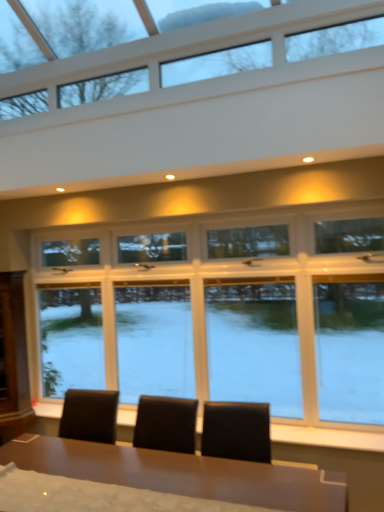
Question: From the image's perspective, is shiny brown table at center beneath clear glass window at upper center, the second window in the bottom-to-top sequence?

Choices:
 (A) yes
 (B) no

Answer: (A)

Question: Is clear glass window at upper center, positioned as the first window in top-to-bottom order, a part of shiny brown table at center?

Choices:
 (A) yes
 (B) no

Answer: (B)

Question: From a real-world perspective, is shiny brown table at center over clear glass window at upper center, positioned as the first window in top-to-bottom order?

Choices:
 (A) yes
 (B) no

Answer: (B)

Question: Is shiny brown table at center positioned far away from clear glass window at upper center, the second window in the bottom-to-top sequence?

Choices:
 (A) yes
 (B) no

Answer: (A)

Question: Does shiny brown table at center appear on the right side of clear glass window at upper center, positioned as the first window in top-to-bottom order?

Choices:
 (A) yes
 (B) no

Answer: (A)

Question: Relative to clear glass window at upper center, positioned as the first window in top-to-bottom order, is clear glass window at center, which is the first window from bottom to top, in front or behind?

Choices:
 (A) front
 (B) behind

Answer: (B)

Question: Choose the correct answer: Is clear glass window at center, which appears as the 2th window when viewed from the top, inside clear glass window at upper center, the second window in the bottom-to-top sequence, or outside it?

Choices:
 (A) inside
 (B) outside

Answer: (B)

Question: From the image's perspective, relative to clear glass window at upper center, positioned as the first window in top-to-bottom order, is clear glass window at center, which appears as the 2th window when viewed from the top, above or below?

Choices:
 (A) below
 (B) above

Answer: (A)

Question: From a real-world perspective, is clear glass window at center, which appears as the 2th window when viewed from the top, above or below clear glass window at upper center, the second window in the bottom-to-top sequence?

Choices:
 (A) below
 (B) above

Answer: (A)

Question: From a real-world perspective, is clear glass window at upper center, positioned as the first window in top-to-bottom order, positioned above or below shiny brown table at center?

Choices:
 (A) above
 (B) below

Answer: (A)

Question: Considering the positions of clear glass window at upper center, positioned as the first window in top-to-bottom order, and shiny brown table at center in the image, is clear glass window at upper center, positioned as the first window in top-to-bottom order, taller or shorter than shiny brown table at center?

Choices:
 (A) tall
 (B) short

Answer: (B)

Question: Considering the relative positions of clear glass window at upper center, the second window in the bottom-to-top sequence, and shiny brown table at center in the image provided, is clear glass window at upper center, the second window in the bottom-to-top sequence, to the left or to the right of shiny brown table at center?

Choices:
 (A) left
 (B) right

Answer: (A)

Question: In terms of size, does clear glass window at upper center, positioned as the first window in top-to-bottom order, appear bigger or smaller than shiny brown table at center?

Choices:
 (A) big
 (B) small

Answer: (B)

Question: Considering the positions of shiny brown table at center and clear glass window at center, which is the first window from bottom to top, in the image, is shiny brown table at center wider or thinner than clear glass window at center, which is the first window from bottom to top,?

Choices:
 (A) wide
 (B) thin

Answer: (A)

Question: From the image's perspective, relative to clear glass window at center, which is the first window from bottom to top, is shiny brown table at center above or below?

Choices:
 (A) below
 (B) above

Answer: (A)